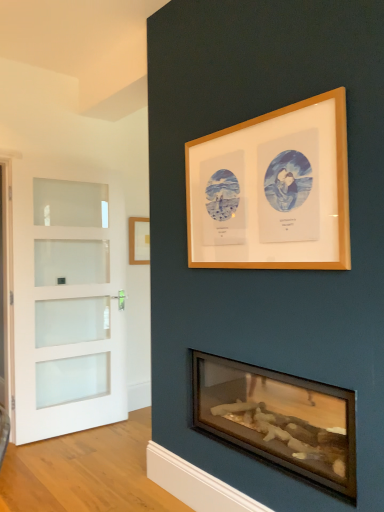
The width and height of the screenshot is (384, 512). Describe the element at coordinates (139, 241) in the screenshot. I see `wooden picture frame at center, the second picture frame from the front` at that location.

In order to face wooden picture frame at upper center, acting as the 2th picture frame starting from the back, should I rotate leftwards or rightwards?

It's best to rotate right around 8.016 degrees.

At what (x,y) coordinates should I click in order to perform the action: click on white frosted glass door at left. Please return your answer as a coordinate pair (x, y). This screenshot has width=384, height=512. Looking at the image, I should click on (66, 298).

I want to click on white frosted glass screen door at left, so click(4, 294).

Image resolution: width=384 pixels, height=512 pixels. What are the coordinates of `wooden picture frame at center, the second picture frame in the right-to-left sequence` in the screenshot? It's located at (139, 241).

Is wooden picture frame at center, the second picture frame from the front, not near white frosted glass door at left?

No, there isn't a large distance between wooden picture frame at center, the second picture frame from the front, and white frosted glass door at left.

Find the location of a particular element. door located on the left of wooden picture frame at center, the second picture frame in the right-to-left sequence is located at coordinates (66, 298).

From the picture: Is wooden picture frame at center, the first picture frame when ordered from left to right, in front of white frosted glass door at left?

No.

Is wooden picture frame at center, the second picture frame from the front, taller or shorter than white frosted glass door at left?

Considering their sizes, wooden picture frame at center, the second picture frame from the front, has less height than white frosted glass door at left.

Which object is further away from the camera, wooden picture frame at upper center, marked as the second picture frame in a left-to-right arrangement, or wooden logs at lower center?

Positioned behind is wooden logs at lower center.

Considering the sizes of objects wooden picture frame at upper center, acting as the 2th picture frame starting from the back, and wooden logs at lower center in the image provided, who is wider, wooden picture frame at upper center, acting as the 2th picture frame starting from the back, or wooden logs at lower center?

Wider between the two is wooden logs at lower center.

Is wooden picture frame at upper center, the first picture frame when ordered from right to left, directly adjacent to wooden logs at lower center?

There is a gap between wooden picture frame at upper center, the first picture frame when ordered from right to left, and wooden logs at lower center.

Who is bigger, wooden picture frame at center, the second picture frame in the right-to-left sequence, or wooden logs at lower center?

With larger size is wooden logs at lower center.

Is wooden picture frame at center, the second picture frame from the front, to the right of wooden logs at lower center from the viewer's perspective?

No.

Who is shorter, wooden picture frame at center, the first picture frame when ordered from left to right, or wooden logs at lower center?

wooden picture frame at center, the first picture frame when ordered from left to right.

In the image, is white frosted glass door at left on the left side or the right side of wooden logs at lower center?

white frosted glass door at left is to the left of wooden logs at lower center.

Considering the relative positions of white frosted glass door at left and wooden logs at lower center in the image provided, is white frosted glass door at left behind wooden logs at lower center?

Yes, white frosted glass door at left is further from the camera.

Consider the image. Is white frosted glass door at left thinner than wooden logs at lower center?

Indeed, white frosted glass door at left has a lesser width compared to wooden logs at lower center.

Which of these two, white frosted glass door at left or wooden logs at lower center, is smaller?

With smaller size is white frosted glass door at left.

From a real-world perspective, is white frosted glass screen door at left over wooden logs at lower center?

Indeed, from a real-world perspective, white frosted glass screen door at left stands above wooden logs at lower center.

Is there a large distance between white frosted glass screen door at left and wooden logs at lower center?

Yes, white frosted glass screen door at left and wooden logs at lower center are quite far apart.

Visually, is white frosted glass screen door at left positioned to the left or to the right of wooden logs at lower center?

white frosted glass screen door at left is positioned on wooden logs at lower center's left side.

The width and height of the screenshot is (384, 512). Find the location of `screen door above the wooden logs at lower center (from the image's perspective)`. screen door above the wooden logs at lower center (from the image's perspective) is located at coordinates (4, 294).

From a real-world perspective, between wooden picture frame at center, the second picture frame in the right-to-left sequence, and wooden picture frame at upper center, the first picture frame when ordered from right to left, who is vertically lower?

From a 3D spatial view, wooden picture frame at center, the second picture frame in the right-to-left sequence, is below.

In terms of height, does wooden picture frame at center, the first picture frame when ordered from left to right, look taller or shorter compared to wooden picture frame at upper center, marked as the 1th picture frame in a front-to-back arrangement?

Considering their sizes, wooden picture frame at center, the first picture frame when ordered from left to right, has less height than wooden picture frame at upper center, marked as the 1th picture frame in a front-to-back arrangement.

Between point (130, 232) and point (271, 226), which one is positioned behind?

Positioned behind is point (130, 232).

Can you confirm if wooden logs at lower center is taller than white frosted glass screen door at left?

In fact, wooden logs at lower center may be shorter than white frosted glass screen door at left.

From a real-world perspective, who is located higher, wooden logs at lower center or white frosted glass screen door at left?

In real-world perspective, white frosted glass screen door at left is above.

Does wooden logs at lower center lie behind white frosted glass screen door at left?

No, wooden logs at lower center is closer to the viewer.

Does wooden logs at lower center have a smaller size compared to white frosted glass screen door at left?

Incorrect, wooden logs at lower center is not smaller in size than white frosted glass screen door at left.

Find the location of a particular element. picture frame that is the 1st one above the white frosted glass door at left (from a real-world perspective) is located at coordinates tap(139, 241).

What are the coordinates of `wood burning stove below the wooden picture frame at upper center, the first picture frame when ordered from right to left (from the image's perspective)` in the screenshot? It's located at (279, 419).

Based on their spatial positions, is white frosted glass screen door at left or wooden picture frame at center, the second picture frame in the right-to-left sequence, further from wooden picture frame at upper center, marked as the 1th picture frame in a front-to-back arrangement?

white frosted glass screen door at left is positioned further to the anchor wooden picture frame at upper center, marked as the 1th picture frame in a front-to-back arrangement.

Which object lies nearer to the anchor point white frosted glass door at left, white frosted glass screen door at left or wooden logs at lower center?

white frosted glass screen door at left is positioned closer to the anchor white frosted glass door at left.

From the picture: Which object lies further to the anchor point white frosted glass door at left, wooden picture frame at center, which appears as the 1th picture frame when viewed from the back, or white frosted glass screen door at left?

Among the two, wooden picture frame at center, which appears as the 1th picture frame when viewed from the back, is located further to white frosted glass door at left.

Considering their positions, is white frosted glass screen door at left positioned further to wooden logs at lower center than white frosted glass door at left?

white frosted glass screen door at left.

When comparing their distances from white frosted glass screen door at left, does white frosted glass door at left or wooden picture frame at upper center, acting as the 2th picture frame starting from the back, seem closer?

Among the two, white frosted glass door at left is located nearer to white frosted glass screen door at left.

Based on their spatial positions, is white frosted glass screen door at left or white frosted glass door at left further from wooden picture frame at center, the second picture frame from the front?

The object further to wooden picture frame at center, the second picture frame from the front, is white frosted glass screen door at left.

Estimate the real-world distances between objects in this image. Which object is further from wooden picture frame at center, the first picture frame when ordered from left to right, wooden picture frame at upper center, marked as the second picture frame in a left-to-right arrangement, or white frosted glass screen door at left?

The object further to wooden picture frame at center, the first picture frame when ordered from left to right, is wooden picture frame at upper center, marked as the second picture frame in a left-to-right arrangement.

Which object lies nearer to the anchor point wooden picture frame at center, the second picture frame from the front, white frosted glass door at left or wooden logs at lower center?

Among the two, white frosted glass door at left is located nearer to wooden picture frame at center, the second picture frame from the front.

Find the location of a particular element. This screenshot has height=512, width=384. door located between wooden logs at lower center and wooden picture frame at center, the second picture frame from the front, in the depth direction is located at coordinates (66, 298).

This screenshot has height=512, width=384. Find the location of `door between wooden picture frame at upper center, acting as the 2th picture frame starting from the back, and wooden picture frame at center, which appears as the 1th picture frame when viewed from the back, from front to back`. door between wooden picture frame at upper center, acting as the 2th picture frame starting from the back, and wooden picture frame at center, which appears as the 1th picture frame when viewed from the back, from front to back is located at coordinates (66, 298).

I want to click on screen door located between wooden logs at lower center and wooden picture frame at center, the second picture frame in the right-to-left sequence, in the depth direction, so click(4, 294).

At what (x,y) coordinates should I click in order to perform the action: click on door between white frosted glass screen door at left and wooden picture frame at center, which appears as the 1th picture frame when viewed from the back. Please return your answer as a coordinate pair (x, y). Looking at the image, I should click on (66, 298).